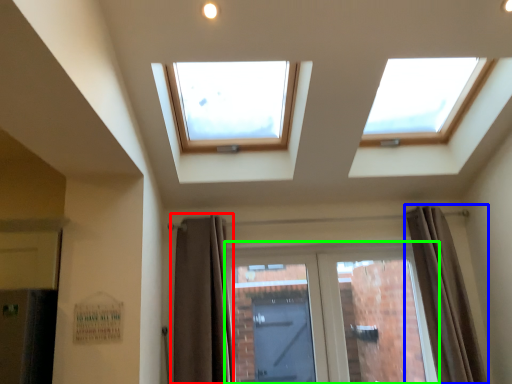
Question: Which is farther away from curtain (highlighted by a red box)? curtain (highlighted by a blue box) or door (highlighted by a green box)?

Choices:
 (A) curtain
 (B) door

Answer: (A)